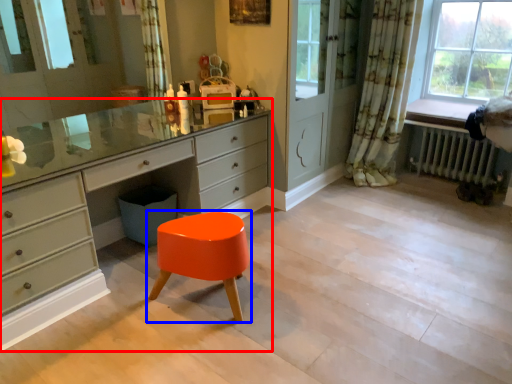
Question: Which object appears farthest to the camera in this image, chest of drawers (highlighted by a red box) or stool (highlighted by a blue box)?

Choices:
 (A) chest of drawers
 (B) stool

Answer: (B)